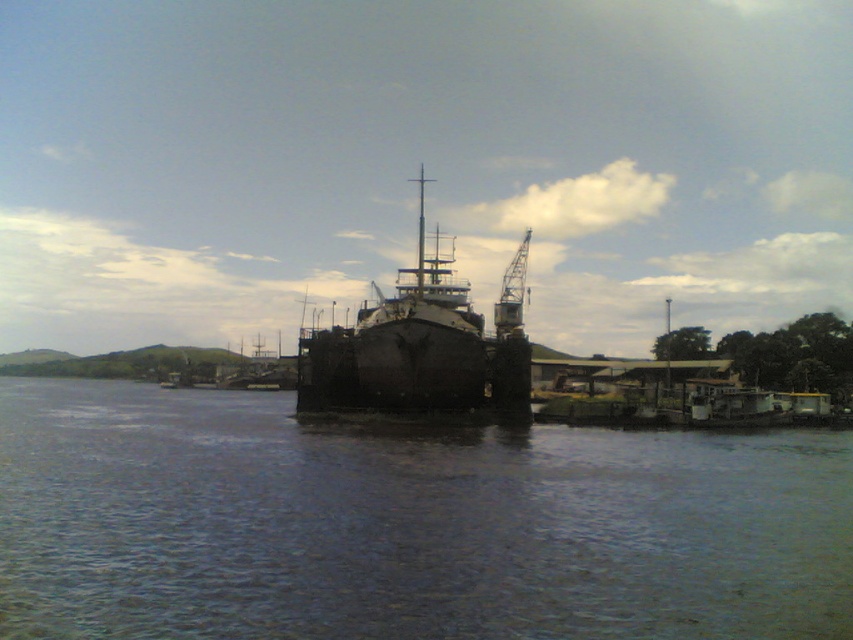
You are standing on the riverside and see the dark blue water at center and the rusty metal ship at center. Which object occupies a larger area in the image?

The rusty metal ship at center occupies a larger area than the dark blue water at center in the image.

You are standing on the riverbank and want to determine which object, the dark blue water at center or the rusty metal ship at center, is taller from your perspective. Which one is taller?

The rusty metal ship at center is taller than the dark blue water at center.

You are standing on the riverside and see the dark blue water at center. Can you confirm if the point marked at coordinates [405,524] corresponds to the dark blue water at center?

Yes, the point marked at coordinates [405,524] corresponds to the dark blue water at center as stated in the objects description.